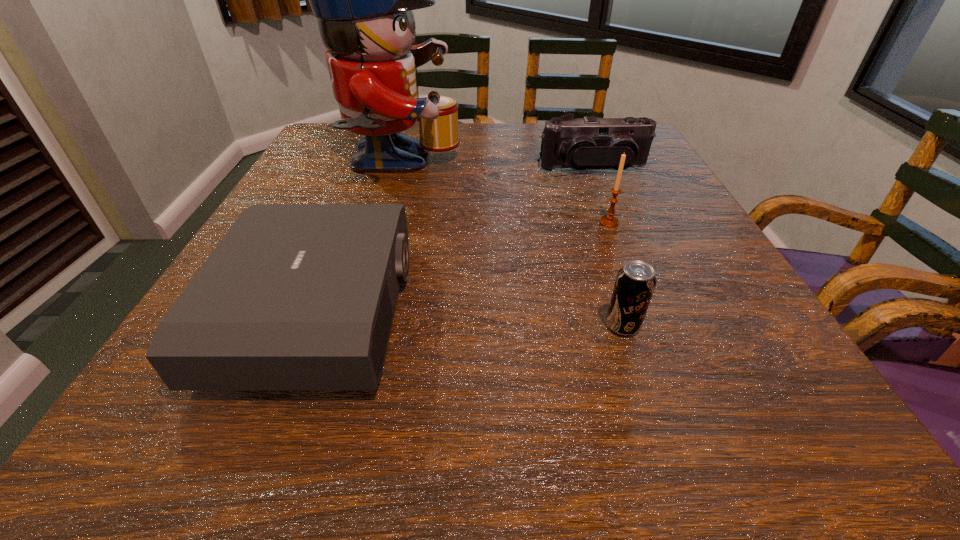
Where is `object present at the far right corner`? object present at the far right corner is located at coordinates (584, 143).

At what (x,y) coordinates should I click in order to perform the action: click on vacant space at the far edge of the desktop. Please return your answer as a coordinate pair (x, y). Looking at the image, I should click on [x=514, y=131].

Locate an element on the screen. This screenshot has height=540, width=960. free region at the near edge is located at coordinates (449, 409).

The image size is (960, 540). I want to click on vacant space at the right edge of the desktop, so click(746, 343).

In the image, there is a desktop. Where is `free region at the near left corner`? Image resolution: width=960 pixels, height=540 pixels. free region at the near left corner is located at coordinates (163, 392).

I want to click on blank space at the near right corner of the desktop, so click(823, 452).

The image size is (960, 540). Find the location of `vacant area that lies between the camcorder and the soda can`. vacant area that lies between the camcorder and the soda can is located at coordinates (608, 247).

Identify the location of vacant space that is in between the camcorder and the candle_holder. The width and height of the screenshot is (960, 540). (601, 195).

Identify the location of free spot between the camcorder and the tallest object. (495, 167).

This screenshot has width=960, height=540. In order to click on free spot between the soda can and the projector in this screenshot , I will do `click(470, 319)`.